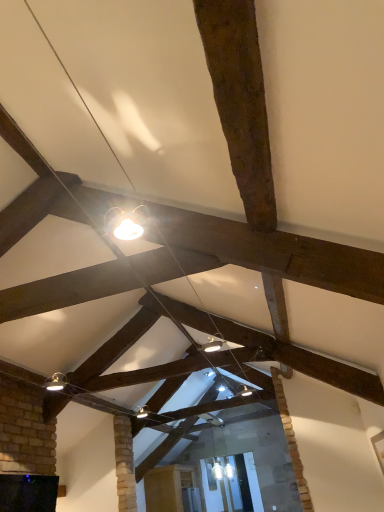
Question: Is matte silver lamp at lower left at the left side of wooden cabinet at center?

Choices:
 (A) yes
 (B) no

Answer: (A)

Question: From the image's perspective, would you say matte silver lamp at lower left is shown under wooden cabinet at center?

Choices:
 (A) yes
 (B) no

Answer: (B)

Question: From the image's perspective, would you say matte silver lamp at lower left is positioned over wooden cabinet at center?

Choices:
 (A) no
 (B) yes

Answer: (B)

Question: Is matte silver lamp at lower left oriented towards wooden cabinet at center?

Choices:
 (A) yes
 (B) no

Answer: (A)

Question: Is matte silver lamp at lower left facing away from wooden cabinet at center?

Choices:
 (A) yes
 (B) no

Answer: (B)

Question: Can you confirm if matte silver lamp at lower left is wider than wooden cabinet at center?

Choices:
 (A) no
 (B) yes

Answer: (A)

Question: Can you confirm if wooden cabinet at center is bigger than matte silver lamp at lower left?

Choices:
 (A) yes
 (B) no

Answer: (A)

Question: From a real-world perspective, is wooden cabinet at center physically below matte silver lamp at lower left?

Choices:
 (A) no
 (B) yes

Answer: (B)

Question: Is wooden cabinet at center not inside matte silver lamp at lower left?

Choices:
 (A) no
 (B) yes

Answer: (B)

Question: Can you confirm if wooden cabinet at center is thinner than matte silver lamp at lower left?

Choices:
 (A) no
 (B) yes

Answer: (A)

Question: Is wooden cabinet at center in front of matte silver lamp at lower left?

Choices:
 (A) yes
 (B) no

Answer: (B)

Question: Is wooden cabinet at center wider than matte silver lamp at lower left?

Choices:
 (A) yes
 (B) no

Answer: (A)

Question: Is matte silver lamp at lower left inside or outside of wooden cabinet at center?

Choices:
 (A) inside
 (B) outside

Answer: (B)